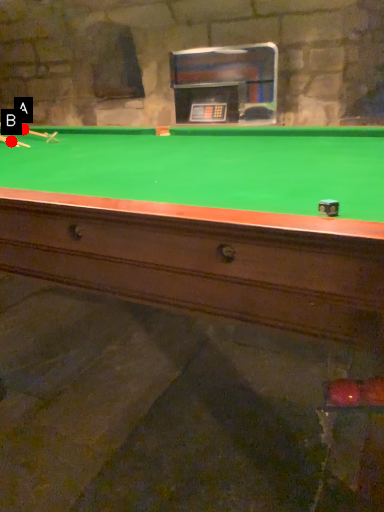
Question: Two points are circled on the image, labeled by A and B beside each circle. Which point is further to the camera?

Choices:
 (A) A is further
 (B) B is further

Answer: (A)